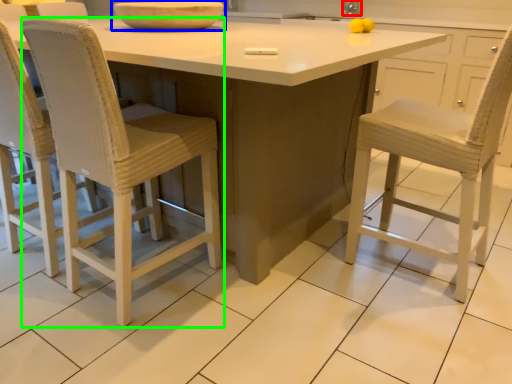
Question: Based on their relative distances, which object is farther from faucet (highlighted by a red box)? Choose from bowl (highlighted by a blue box) and chair (highlighted by a green box).

Choices:
 (A) bowl
 (B) chair

Answer: (B)